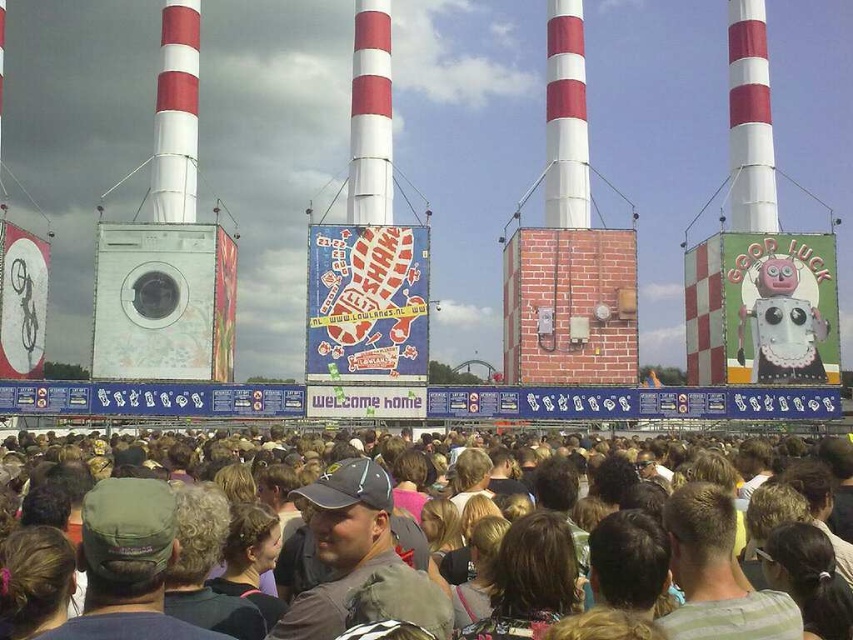
Question: Is dark gray fabric cap at center below white striped rocket at upper right?

Choices:
 (A) yes
 (B) no

Answer: (A)

Question: Which point is farther from the camera taking this photo?

Choices:
 (A) (190, 64)
 (B) (578, 218)
 (C) (354, 224)
 (D) (384, 589)

Answer: (A)

Question: Considering the real-world distances, which object is closest to the white striped rocket at upper center?

Choices:
 (A) brick textured tower at center
 (B) white striped rocket at upper right
 (C) white striped rocket at upper left
 (D) brown hair at center

Answer: (A)

Question: Is white matte washing machine at left below brick textured tower at center?

Choices:
 (A) yes
 (B) no

Answer: (A)

Question: Is brick textured tower at center below white striped rocket at upper right?

Choices:
 (A) no
 (B) yes

Answer: (B)

Question: Which object appears closest to the camera in this image?

Choices:
 (A) white striped rocket at upper center
 (B) brick textured tower at center
 (C) dark gray fabric cap at center

Answer: (C)